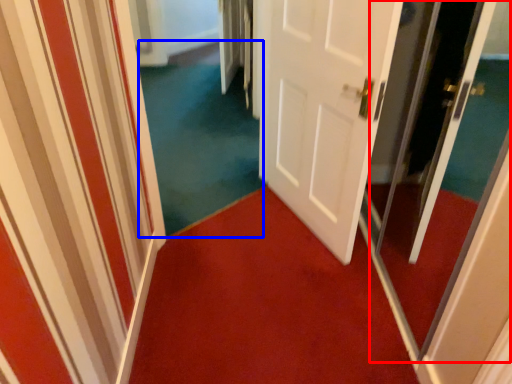
Question: Which object appears closest to the camera in this image, screen door (highlighted by a red box) or plain (highlighted by a blue box)?

Choices:
 (A) screen door
 (B) plain

Answer: (A)